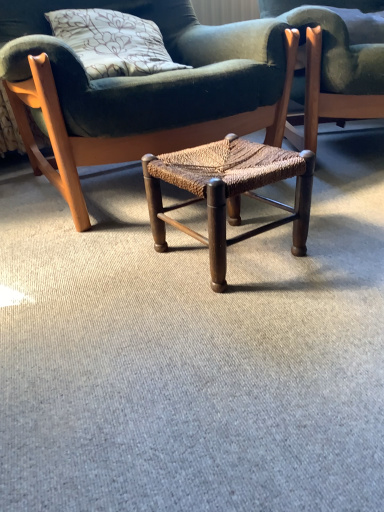
Question: From their relative heights in the image, would you say woven wood stool at center, the first chair viewed from the left, is taller or shorter than woven wood stool at center?

Choices:
 (A) tall
 (B) short

Answer: (A)

Question: Does point (249, 88) appear closer or farther from the camera than point (264, 181)?

Choices:
 (A) closer
 (B) farther

Answer: (B)

Question: Based on their relative distances, which object is nearer to the woven wood chair at center, arranged as the 1th chair when viewed from the right?

Choices:
 (A) woven wood stool at center
 (B) velvet floral pillow at upper left
 (C) woven wood stool at center, the first chair viewed from the left

Answer: (C)

Question: Which object is positioned closest to the woven wood stool at center, the first chair viewed from the left?

Choices:
 (A) woven wood chair at center, marked as the second chair in a left-to-right arrangement
 (B) woven wood stool at center
 (C) velvet floral pillow at upper left

Answer: (C)